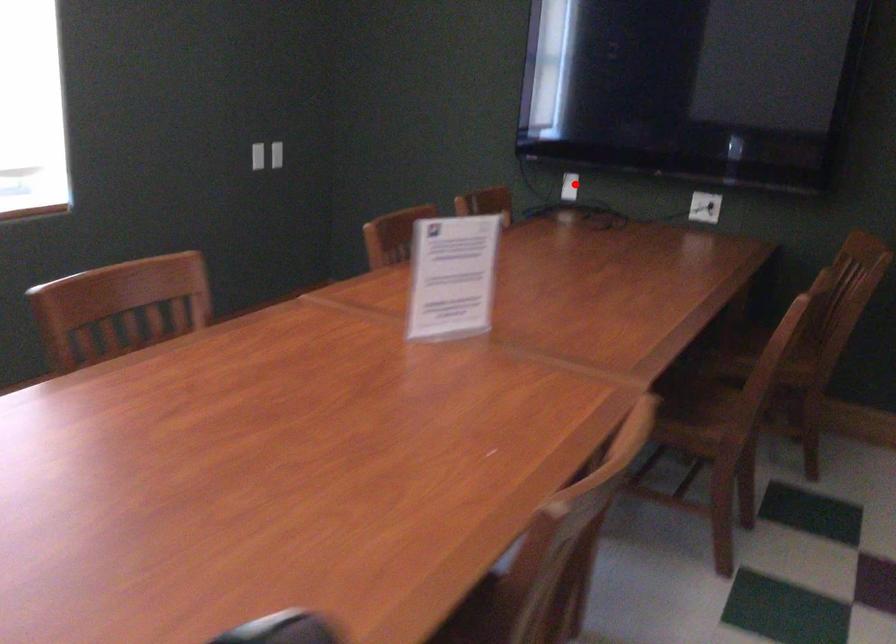
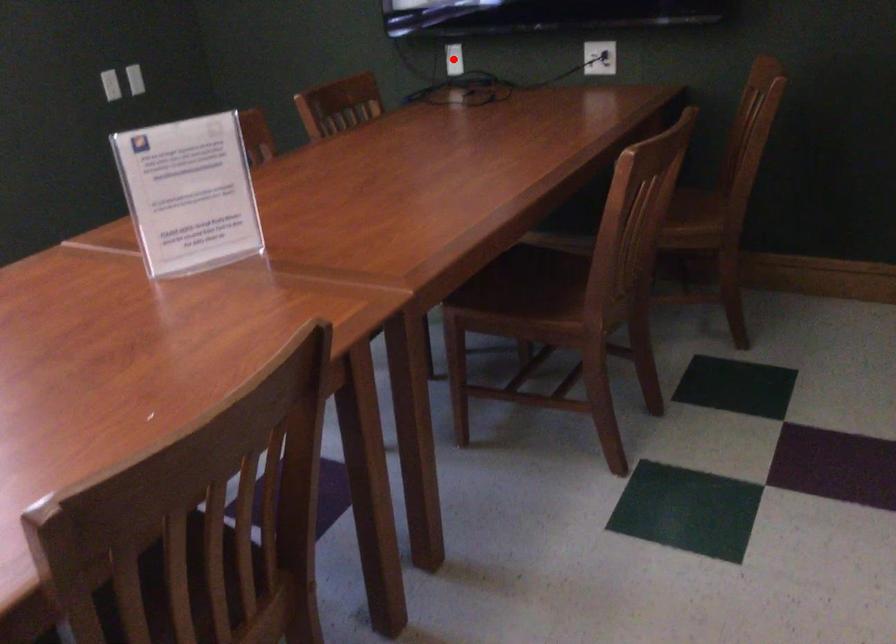
I am providing you with two images of the same scene from different viewpoints. A red point is marked on the first image and another point is marked on the second image. Are the points marked in image1 and image2 representing the same 3D position?

Yes